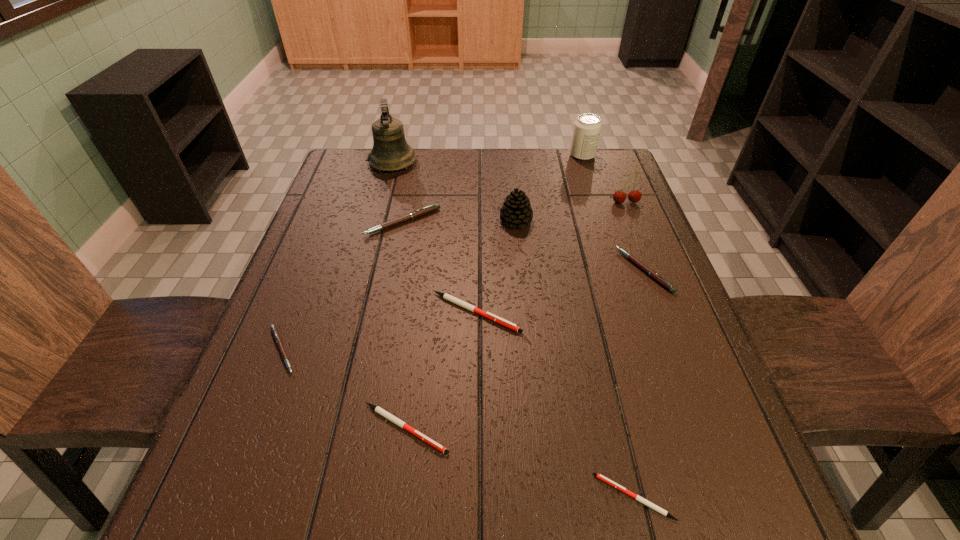
Where is `empty space between the ninth shortest object and the bell`? empty space between the ninth shortest object and the bell is located at coordinates (488, 159).

Identify the location of free space between the leftmost pink pen and the soda can. (432, 253).

Locate an element on the screen. This screenshot has height=540, width=960. free space between the ninth shortest object and the third farthest object is located at coordinates 604,179.

The width and height of the screenshot is (960, 540). I want to click on vacant space in between the leftmost object and the pinecone, so click(398, 285).

I want to click on vacant point located between the nearest object and the second nearest pink pen, so click(x=639, y=383).

This screenshot has height=540, width=960. In order to click on empty space that is in between the rightmost pink pen and the soda can in this screenshot , I will do `click(613, 213)`.

This screenshot has width=960, height=540. What are the coordinates of `the seventh closest object to the leftmost pen` in the screenshot? It's located at (646, 269).

Locate which object is the second closest to the biggest white pen. Please provide its 2D coordinates. Your answer should be formatted as a tuple, i.e. [(x, y)], where the tuple contains the x and y coordinates of a point satisfying the conditions above.

[(434, 207)]

You are a GUI agent. You are given a task and a screenshot of the screen. Output one action in this format:
    pyautogui.click(x=<x>, y=<y>)
    Task: Click on the second closest pen to the ninth shortest object
    This screenshot has height=540, width=960.
    Given the screenshot: What is the action you would take?
    pyautogui.click(x=434, y=207)

At what (x,y) coordinates should I click in order to perform the action: click on the fourth closest pen to the second nearest white pen. Please return your answer as a coordinate pair (x, y). This screenshot has height=540, width=960. Looking at the image, I should click on (434, 207).